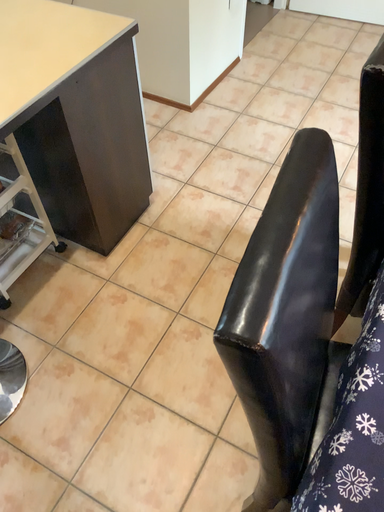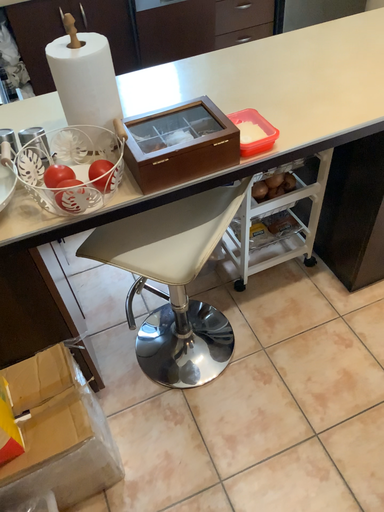
Question: How did the camera likely rotate when shooting the video?

Choices:
 (A) rotated upward
 (B) rotated downward

Answer: (A)